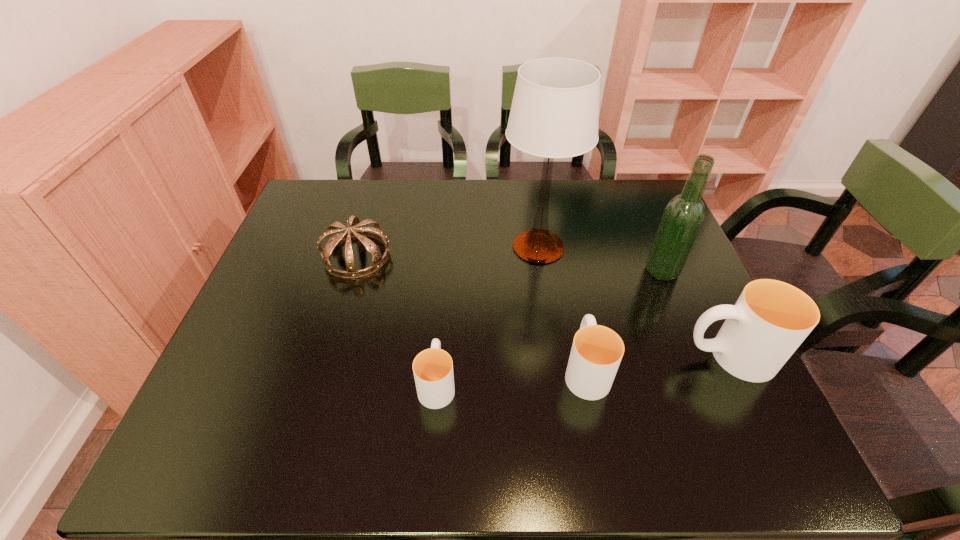
At what (x,y) coordinates should I click in order to perform the action: click on object located at the far edge. Please return your answer as a coordinate pair (x, y). This screenshot has height=540, width=960. Looking at the image, I should click on (555, 109).

Image resolution: width=960 pixels, height=540 pixels. Find the location of `object that is positioned at the left edge`. object that is positioned at the left edge is located at coordinates (361, 233).

Identify the location of cup present at the right edge. The height and width of the screenshot is (540, 960). (770, 320).

Image resolution: width=960 pixels, height=540 pixels. I want to click on liquor that is at the right edge, so click(x=683, y=216).

Locate an element on the screen. Image resolution: width=960 pixels, height=540 pixels. object that is at the near right corner is located at coordinates (770, 320).

Where is `free location at the far edge`? free location at the far edge is located at coordinates (416, 207).

Find the location of `free spot at the near edge of the desktop`. free spot at the near edge of the desktop is located at coordinates (546, 397).

The image size is (960, 540). I want to click on vacant space at the left edge, so click(x=272, y=269).

I want to click on vacant space at the right edge of the desktop, so click(x=674, y=374).

At what (x,y) coordinates should I click in order to perform the action: click on vacant space at the near right corner of the desktop. Please return your answer as a coordinate pair (x, y). Looking at the image, I should click on (741, 410).